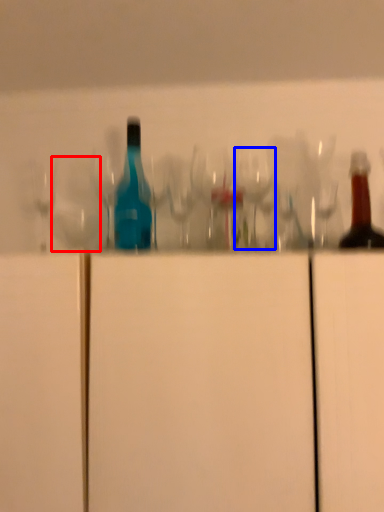
Question: Among these objects, which one is nearest to the camera, shot glass (highlighted by a red box) or wine glass (highlighted by a blue box)?

Choices:
 (A) shot glass
 (B) wine glass

Answer: (B)